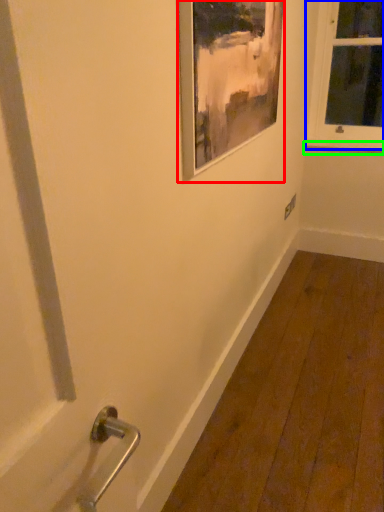
Question: Estimate the real-world distances between objects in this image. Which object is closer to picture frame (highlighted by a red box), window (highlighted by a blue box) or window sill (highlighted by a green box)?

Choices:
 (A) window
 (B) window sill

Answer: (A)